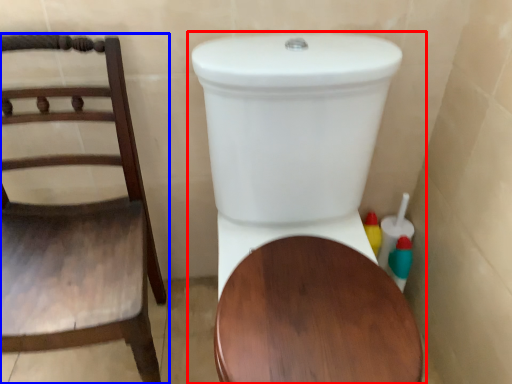
Question: Which object appears farthest to the camera in this image, toilet (highlighted by a red box) or chair (highlighted by a blue box)?

Choices:
 (A) toilet
 (B) chair

Answer: (B)